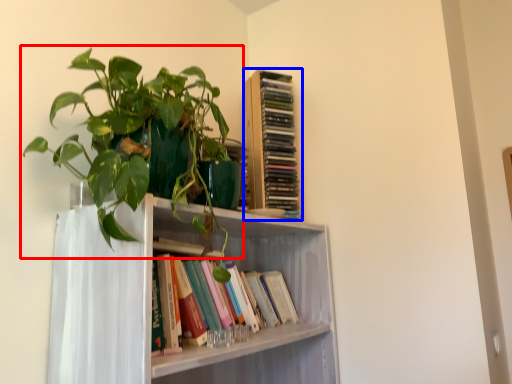
Question: Which of the following is the closest to the observer, houseplant (highlighted by a red box) or book (highlighted by a blue box)?

Choices:
 (A) houseplant
 (B) book

Answer: (A)